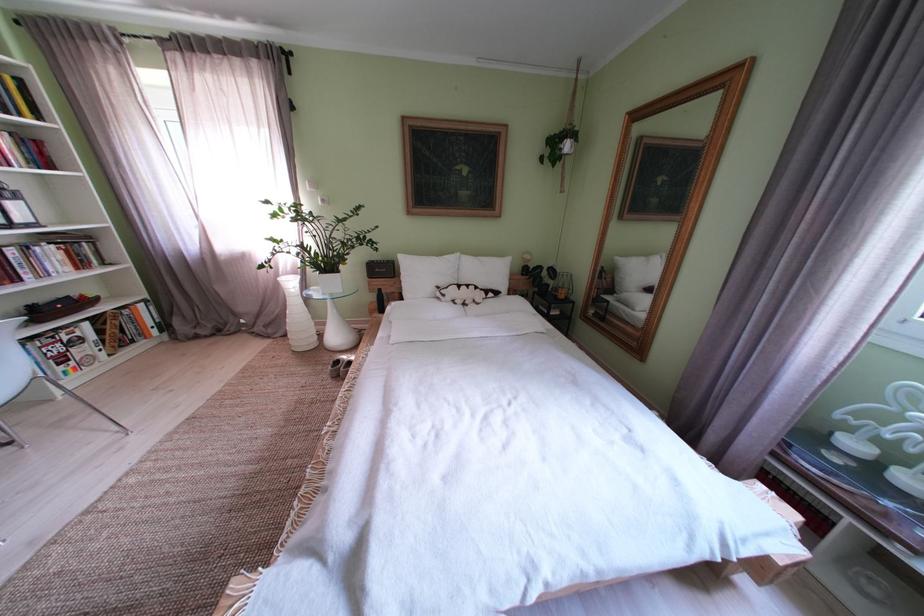
Describe the element at coordinates (297, 315) in the screenshot. I see `the white plant pot` at that location.